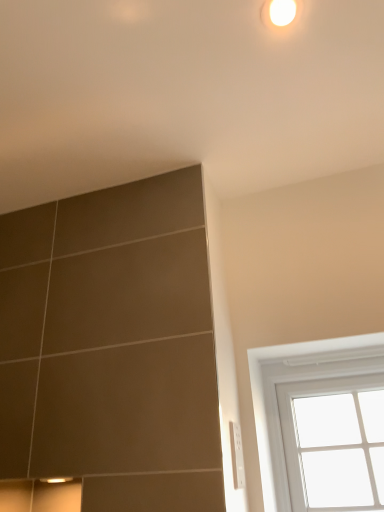
Question: Can you confirm if white glossy light at upper center is smaller than white glass window at upper right?

Choices:
 (A) no
 (B) yes

Answer: (B)

Question: From a real-world perspective, is white glossy light at upper center on white glass window at upper right?

Choices:
 (A) yes
 (B) no

Answer: (A)

Question: Does white glossy light at upper center have a larger size compared to white glass window at upper right?

Choices:
 (A) yes
 (B) no

Answer: (B)

Question: Does white glossy light at upper center lie behind white glass window at upper right?

Choices:
 (A) no
 (B) yes

Answer: (A)

Question: Is white glossy light at upper center outside of white glass window at upper right?

Choices:
 (A) yes
 (B) no

Answer: (A)

Question: From the image's perspective, is white glossy light at upper center over white glass window at upper right?

Choices:
 (A) no
 (B) yes

Answer: (B)

Question: From the image's perspective, is white glass window at upper right beneath white glossy light at upper center?

Choices:
 (A) yes
 (B) no

Answer: (A)

Question: Considering the relative positions of white glass window at upper right and white glossy light at upper center in the image provided, is white glass window at upper right to the left of white glossy light at upper center from the viewer's perspective?

Choices:
 (A) yes
 (B) no

Answer: (B)

Question: Is the position of white glass window at upper right less distant than that of white glossy light at upper center?

Choices:
 (A) no
 (B) yes

Answer: (A)

Question: Considering the relative positions of white glass window at upper right and white glossy light at upper center in the image provided, is white glass window at upper right to the right of white glossy light at upper center from the viewer's perspective?

Choices:
 (A) no
 (B) yes

Answer: (B)

Question: Can we say white glass window at upper right lies outside white glossy light at upper center?

Choices:
 (A) yes
 (B) no

Answer: (A)

Question: Is white glass window at upper right smaller than white glossy light at upper center?

Choices:
 (A) no
 (B) yes

Answer: (A)

Question: Are white plastic electrical outlet at lower right and white glass window at upper right located far from each other?

Choices:
 (A) yes
 (B) no

Answer: (B)